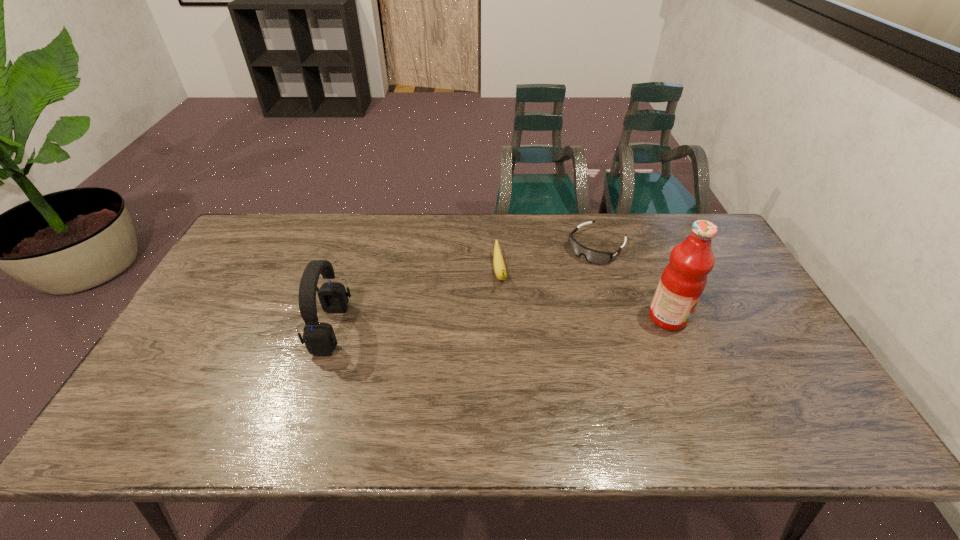
Locate an element on the screen. The width and height of the screenshot is (960, 540). unoccupied area between the third shortest object and the goggles is located at coordinates (464, 288).

Find the location of a particular element. The height and width of the screenshot is (540, 960). vacant space that's between the shortest object and the tallest object is located at coordinates (632, 282).

This screenshot has width=960, height=540. In order to click on free space that is in between the shortest object and the headset in this screenshot , I will do `click(464, 288)`.

Where is `vacant region between the second tallest object and the third tallest object`? Image resolution: width=960 pixels, height=540 pixels. vacant region between the second tallest object and the third tallest object is located at coordinates (416, 301).

Identify the location of object that is the second nearest to the second tallest object. The width and height of the screenshot is (960, 540). (593, 256).

You are a GUI agent. You are given a task and a screenshot of the screen. Output one action in this format:
    pyautogui.click(x=<x>, y=<y>)
    Task: Click on the object that ranks as the second closest to the headset
    The image size is (960, 540).
    Given the screenshot: What is the action you would take?
    pyautogui.click(x=593, y=256)

Find the location of a particular element. The image size is (960, 540). free region that satisfies the following two spatial constraints: 1. on the front side of the goggles; 2. on the front label of the fruit juice is located at coordinates (618, 318).